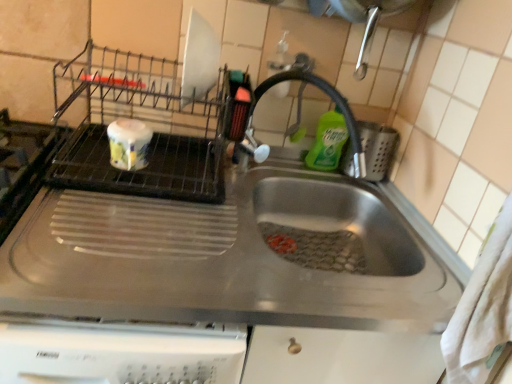
At what (x,y) coordinates should I click in order to perform the action: click on free region on the left part of green liquid soap at upper right. Please return your answer as a coordinate pair (x, y). The height and width of the screenshot is (384, 512). Looking at the image, I should click on (273, 169).